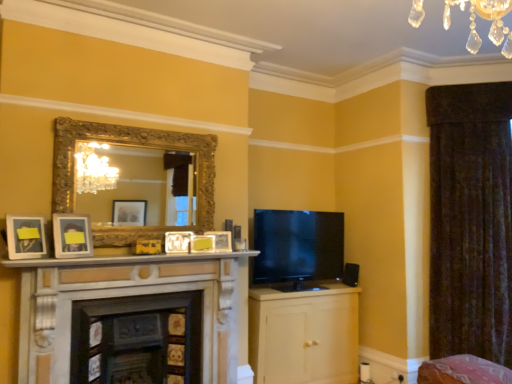
Question: Is black glossy flat-screen tv at center-right next to matte yellow picture frame at center, the second picture frame in the right-to-left sequence, and touching it?

Choices:
 (A) yes
 (B) no

Answer: (B)

Question: Is black glossy flat-screen tv at center-right positioned beyond the bounds of matte yellow picture frame at center, the second picture frame in the right-to-left sequence?

Choices:
 (A) yes
 (B) no

Answer: (A)

Question: Is black glossy flat-screen tv at center-right at the right side of matte yellow picture frame at center, the fifth picture frame in the left-to-right sequence?

Choices:
 (A) yes
 (B) no

Answer: (A)

Question: From the image's perspective, is black glossy flat-screen tv at center-right above matte yellow picture frame at center, the second picture frame in the right-to-left sequence?

Choices:
 (A) yes
 (B) no

Answer: (B)

Question: Is matte yellow picture frame at center, the fifth picture frame in the left-to-right sequence, located within black glossy flat-screen tv at center-right?

Choices:
 (A) yes
 (B) no

Answer: (B)

Question: Is matte white picture frame at lower left, the first picture frame when ordered from left to right, in front of or behind velvet dark brown curtain at right in the image?

Choices:
 (A) behind
 (B) front

Answer: (B)

Question: Considering the relative positions of matte white picture frame at lower left, the first picture frame when ordered from left to right, and velvet dark brown curtain at right in the image provided, is matte white picture frame at lower left, the first picture frame when ordered from left to right, to the left or to the right of velvet dark brown curtain at right?

Choices:
 (A) right
 (B) left

Answer: (B)

Question: Choose the correct answer: Is matte white picture frame at lower left, which appears as the 6th picture frame when viewed from the right, inside velvet dark brown curtain at right or outside it?

Choices:
 (A) outside
 (B) inside

Answer: (A)

Question: Considering the positions of point (20, 243) and point (446, 178), is point (20, 243) closer or farther from the camera than point (446, 178)?

Choices:
 (A) closer
 (B) farther

Answer: (A)

Question: Relative to wooden fireplace at lower center, the 2th fireplace from the right, is velvet dark brown curtain at right in front or behind?

Choices:
 (A) front
 (B) behind

Answer: (B)

Question: From a real-world perspective, relative to wooden fireplace at lower center, the 2th fireplace from the right, is velvet dark brown curtain at right vertically above or below?

Choices:
 (A) below
 (B) above

Answer: (B)

Question: Considering the positions of velvet dark brown curtain at right and wooden fireplace at lower center, the 2th fireplace from the right, in the image, is velvet dark brown curtain at right bigger or smaller than wooden fireplace at lower center, the 2th fireplace from the right,?

Choices:
 (A) small
 (B) big

Answer: (B)

Question: Is velvet dark brown curtain at right to the left or to the right of wooden fireplace at lower center, the 2th fireplace from the right, in the image?

Choices:
 (A) left
 (B) right

Answer: (B)

Question: From a real-world perspective, is velvet dark brown curtain at right above or below pink fabric swivel chair at lower right?

Choices:
 (A) above
 (B) below

Answer: (A)

Question: Considering the relative positions of velvet dark brown curtain at right and pink fabric swivel chair at lower right in the image provided, is velvet dark brown curtain at right to the left or to the right of pink fabric swivel chair at lower right?

Choices:
 (A) left
 (B) right

Answer: (B)